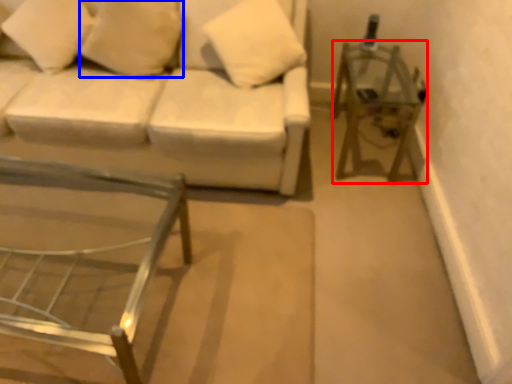
Question: Among these objects, which one is nearest to the camera, side table (highlighted by a red box) or pillow (highlighted by a blue box)?

Choices:
 (A) side table
 (B) pillow

Answer: (B)